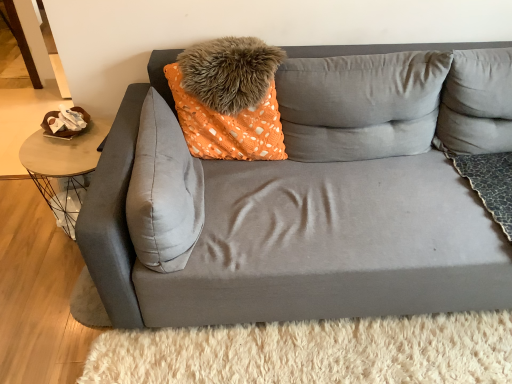
Question: Is the position of orange dotted fabric pillow at center, which is the 2th pillow in left-to-right order, more distant than that of fuzzy orange pillow at upper center, arranged as the third pillow when viewed from the left?

Choices:
 (A) yes
 (B) no

Answer: (B)

Question: Can you confirm if orange dotted fabric pillow at center, which appears as the 4th pillow when viewed from the right, is shorter than fuzzy orange pillow at upper center, which is the third pillow from right to left?

Choices:
 (A) yes
 (B) no

Answer: (B)

Question: From the image's perspective, would you say orange dotted fabric pillow at center, which appears as the 4th pillow when viewed from the right, is shown under fuzzy orange pillow at upper center, which is the third pillow from right to left?

Choices:
 (A) yes
 (B) no

Answer: (A)

Question: From a real-world perspective, is orange dotted fabric pillow at center, which appears as the 4th pillow when viewed from the right, over fuzzy orange pillow at upper center, arranged as the third pillow when viewed from the left?

Choices:
 (A) yes
 (B) no

Answer: (B)

Question: Is orange dotted fabric pillow at center, which appears as the 4th pillow when viewed from the right, aimed at fuzzy orange pillow at upper center, which is the third pillow from right to left?

Choices:
 (A) yes
 (B) no

Answer: (A)

Question: Are orange dotted fabric pillow at center, which is the 2th pillow in left-to-right order, and fuzzy orange pillow at upper center, arranged as the third pillow when viewed from the left, far apart?

Choices:
 (A) no
 (B) yes

Answer: (A)

Question: From a real-world perspective, is metallic wire table at left positioned over orange dotted fabric pillow at center, which is the 2th pillow in left-to-right order, based on gravity?

Choices:
 (A) yes
 (B) no

Answer: (B)

Question: Is metallic wire table at left located outside orange dotted fabric pillow at center, which appears as the 4th pillow when viewed from the right?

Choices:
 (A) no
 (B) yes

Answer: (B)

Question: Is metallic wire table at left turned away from orange dotted fabric pillow at center, which is the 2th pillow in left-to-right order?

Choices:
 (A) yes
 (B) no

Answer: (B)

Question: Is metallic wire table at left aimed at orange dotted fabric pillow at center, which appears as the 4th pillow when viewed from the right?

Choices:
 (A) no
 (B) yes

Answer: (A)

Question: Could orange dotted fabric pillow at center, which appears as the 4th pillow when viewed from the right, be considered to be inside metallic wire table at left?

Choices:
 (A) no
 (B) yes

Answer: (A)

Question: From the image's perspective, is metallic wire table at left beneath orange dotted fabric pillow at center, which appears as the 4th pillow when viewed from the right?

Choices:
 (A) no
 (B) yes

Answer: (B)

Question: Is gray fabric pillow at center, which is the fourth pillow in left-to-right order, located outside suede gray pillow at center, the first pillow positioned from the left?

Choices:
 (A) yes
 (B) no

Answer: (A)